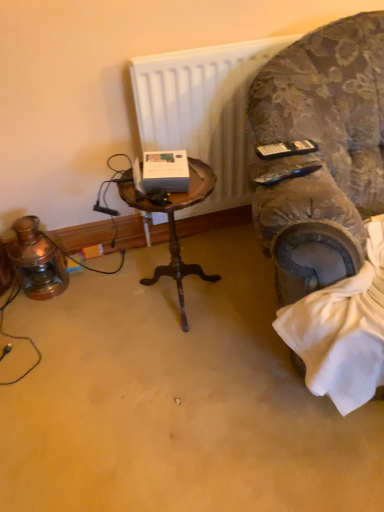
This screenshot has width=384, height=512. Find the location of `free space in front of woodenobject at center`. free space in front of woodenobject at center is located at coordinates (178, 365).